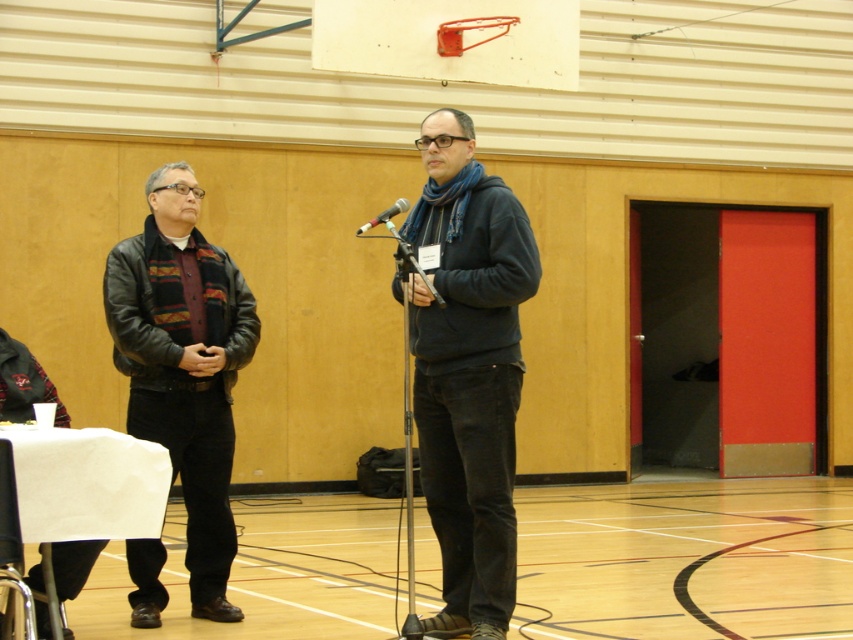
You need to place a rectangular box that is 2 meters wide on the wooden floor at center. Can the silver metallic microphone at center be placed on the same floor without overlapping the box?

The wooden floor at center might be wider than silver metallic microphone at center, so it is possible that the microphone can be placed on the floor without overlapping the box. However, the exact width of the floor and microphone are not specified, so further measurements are needed to confirm.

You are standing in a gymnasium and see a dark gray hoodie at center. If you want to reach it without moving your feet, can you do so?

The dark gray hoodie at center is 5.89 meters away from viewer, so you cannot reach it without moving your feet because it is too far.